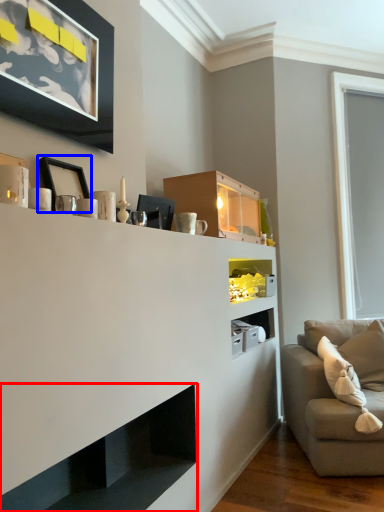
Question: Which point is further to the camera, shelf (highlighted by a red box) or picture frame (highlighted by a blue box)?

Choices:
 (A) shelf
 (B) picture frame

Answer: (B)